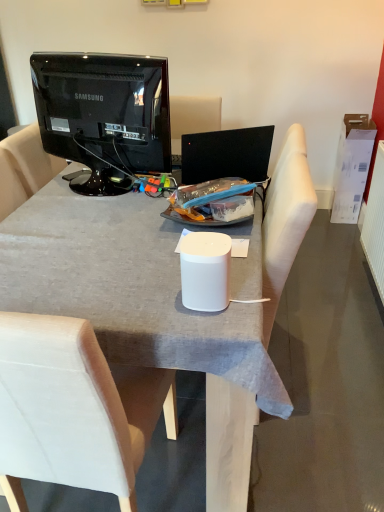
Question: Is white fabric chair at center in front of or behind white cardboard box at right in the image?

Choices:
 (A) behind
 (B) front

Answer: (B)

Question: Is white fabric chair at center to the left or to the right of white cardboard box at right in the image?

Choices:
 (A) right
 (B) left

Answer: (B)

Question: Estimate the real-world distances between objects in this image. Which object is closer to the white cardboard box at right?

Choices:
 (A) white fabric armchair at center
 (B) glossy black television at upper left
 (C) white matte desk at center
 (D) white fabric chair at center
 (E) white matte smart speaker at center

Answer: (A)

Question: Which is nearer to the white cardboard box at right?

Choices:
 (A) glossy black television at upper left
 (B) white matte desk at center
 (C) white fabric chair at center
 (D) white matte smart speaker at center
 (E) white fabric armchair at center

Answer: (E)